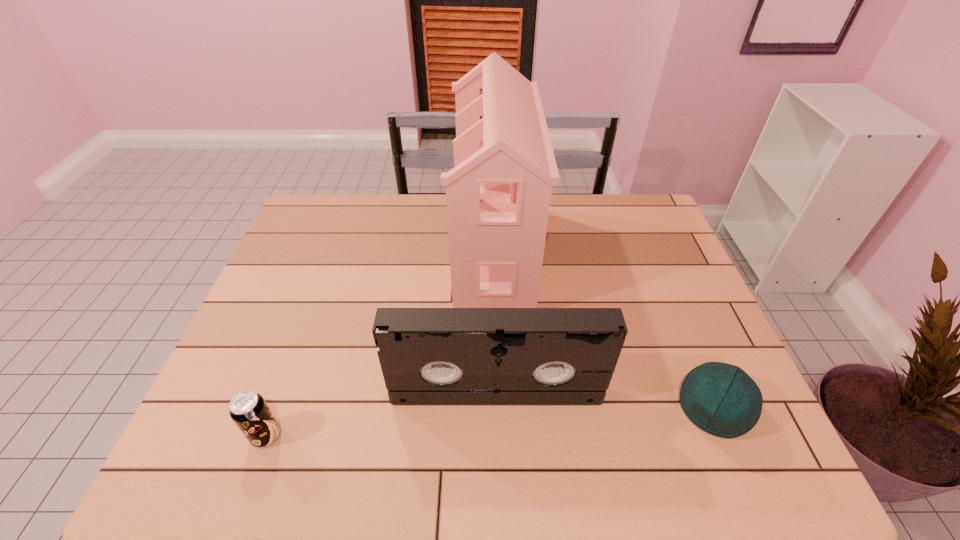
At what (x,y) coordinates should I click in order to perform the action: click on free space that satisfies the following two spatial constraints: 1. on the side of the beanie with visible spindles; 2. on the right side of the videotape. Please return your answer as a coordinate pair (x, y). This screenshot has width=960, height=540. Looking at the image, I should click on (496, 408).

This screenshot has height=540, width=960. Identify the location of free space that satisfies the following two spatial constraints: 1. on the front-facing side of the tallest object; 2. on the left side of the beanie. (498, 408).

Identify the location of free space that satisfies the following two spatial constraints: 1. on the front-facing side of the dollhouse; 2. on the side of the videotape with visible spindles. This screenshot has height=540, width=960. (498, 393).